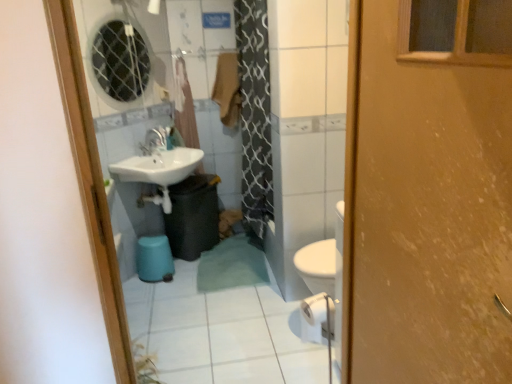
At what (x,y) coordinates should I click in order to perform the action: click on black plastic trash can at lower center. Please return your answer as a coordinate pair (x, y). This screenshot has height=384, width=512. Looking at the image, I should click on (193, 216).

Find the location of `matte white faucet at center`. matte white faucet at center is located at coordinates (156, 141).

This screenshot has height=384, width=512. Find the location of `transparent glass mirror at upper left`. transparent glass mirror at upper left is located at coordinates (119, 62).

At what (x,y) coordinates should I click in order to perform the action: click on brown fabric towel at upper center. Please return your answer as a coordinate pair (x, y). This screenshot has height=384, width=512. Looking at the image, I should click on (227, 89).

From a real-world perspective, is wooden door at right under brown fabric towel at upper center?

Yes, from a real-world perspective, wooden door at right is beneath brown fabric towel at upper center.

In terms of width, does wooden door at right look wider or thinner when compared to brown fabric towel at upper center?

Considering their sizes, wooden door at right looks broader than brown fabric towel at upper center.

Consider the image. Does wooden door at right appear on the right side of brown fabric towel at upper center?

Correct, you'll find wooden door at right to the right of brown fabric towel at upper center.

Are wooden door at right and brown fabric towel at upper center beside each other?

No, wooden door at right is not touching brown fabric towel at upper center.

Identify the location of laundry to the right of black plastic trash can at lower center. The width and height of the screenshot is (512, 384). (227, 89).

Which object is closer to the camera, brown fabric towel at upper center or black plastic trash can at lower center?

Positioned in front is black plastic trash can at lower center.

Is brown fabric towel at upper center at the left side of black plastic trash can at lower center?

Incorrect, brown fabric towel at upper center is not on the left side of black plastic trash can at lower center.

Can you confirm if brown fabric towel at upper center is thinner than black plastic trash can at lower center?

Yes, brown fabric towel at upper center is thinner than black plastic trash can at lower center.

Which of these two, brown fabric towel at upper center or translucent plastic curtain at upper center, stands taller?

With more height is translucent plastic curtain at upper center.

In the scene shown: Considering the positions of objects brown fabric towel at upper center and translucent plastic curtain at upper center in the image provided, who is more to the right, brown fabric towel at upper center or translucent plastic curtain at upper center?

From the viewer's perspective, brown fabric towel at upper center appears more on the right side.

Is translucent plastic curtain at upper center at the back of brown fabric towel at upper center?

brown fabric towel at upper center is not turned away from translucent plastic curtain at upper center.

Could you tell me if wooden door at right is turned towards black plastic trash can at lower center?

No.

Which is behind, wooden door at right or black plastic trash can at lower center?

black plastic trash can at lower center is further away from the camera.

From the image's perspective, is wooden door at right above or below black plastic trash can at lower center?

wooden door at right is below black plastic trash can at lower center.

In terms of width, does wooden door at right look wider or thinner when compared to black plastic trash can at lower center?

wooden door at right is thinner than black plastic trash can at lower center.

From a real-world perspective, is black plastic trash can at lower center located beneath matte white faucet at center?

Yes.

Is matte white faucet at center at the back of black plastic trash can at lower center?

No, black plastic trash can at lower center is not facing the opposite direction of matte white faucet at center.

How distant is black plastic trash can at lower center from matte white faucet at center?

They are 20.84 inches apart.

The image size is (512, 384). Identify the location of tap on the left side of black plastic trash can at lower center. pyautogui.click(x=156, y=141).

Does black plastic trash can at lower center have a smaller size compared to brown fabric towel at upper center?

No.

Would you say black plastic trash can at lower center is a long distance from brown fabric towel at upper center?

They are positioned close to each other.

Could brown fabric towel at upper center be considered to be inside black plastic trash can at lower center?

No, black plastic trash can at lower center does not contain brown fabric towel at upper center.

Is point (185, 243) positioned before point (237, 101)?

Yes, it is.

Is matte blue stool at lower left facing away from translucent plastic curtain at upper center?

That's not correct — matte blue stool at lower left is not looking away from translucent plastic curtain at upper center.

Considering the sizes of objects matte blue stool at lower left and translucent plastic curtain at upper center in the image provided, who is wider, matte blue stool at lower left or translucent plastic curtain at upper center?

With larger width is matte blue stool at lower left.

How many degrees apart are the facing directions of matte blue stool at lower left and translucent plastic curtain at upper center?

The angle between the facing direction of matte blue stool at lower left and the facing direction of translucent plastic curtain at upper center is 55.7 degrees.

From the image's perspective, is matte blue stool at lower left below translucent plastic curtain at upper center?

Indeed, from the image's perspective, matte blue stool at lower left is shown beneath translucent plastic curtain at upper center.

Where is `door in front of the brown fabric towel at upper center`? The width and height of the screenshot is (512, 384). door in front of the brown fabric towel at upper center is located at coordinates (424, 212).

You are a GUI agent. You are given a task and a screenshot of the screen. Output one action in this format:
    pyautogui.click(x=<x>, y=<y>)
    Task: Click on the laundry behind the black plastic trash can at lower center
    The image size is (512, 384).
    Given the screenshot: What is the action you would take?
    pyautogui.click(x=227, y=89)

From the picture: Considering their positions, is translucent plastic curtain at upper center positioned closer to brown fabric towel at upper center than matte white faucet at center?

Among the two, translucent plastic curtain at upper center is located nearer to brown fabric towel at upper center.

Estimate the real-world distances between objects in this image. Which object is closer to matte white faucet at center, wooden door at right or transparent glass mirror at upper left?

transparent glass mirror at upper left lies closer to matte white faucet at center than the other object.

When comparing their distances from matte blue stool at lower left, does black plastic trash can at lower center or brown fabric towel at upper center seem further?

The object further to matte blue stool at lower left is brown fabric towel at upper center.

When comparing their distances from wooden door at right, does translucent plastic curtain at upper center or transparent glass mirror at upper left seem further?

The object further to wooden door at right is transparent glass mirror at upper left.

From the picture: Looking at the image, which one is located closer to matte blue stool at lower left, transparent glass mirror at upper left or black plastic trash can at lower center?

black plastic trash can at lower center.

Based on their spatial positions, is transparent glass mirror at upper left or matte blue stool at lower left further from matte white faucet at center?

Based on the image, transparent glass mirror at upper left appears to be further to matte white faucet at center.

Looking at the image, which one is located further to transparent glass mirror at upper left, wooden door at right or matte white faucet at center?

Based on the image, wooden door at right appears to be further to transparent glass mirror at upper left.

When comparing their distances from brown fabric towel at upper center, does black plastic trash can at lower center or wooden door at right seem closer?

Among the two, black plastic trash can at lower center is located nearer to brown fabric towel at upper center.

Locate an element on the screen. tap between translucent plastic curtain at upper center and matte blue stool at lower left vertically is located at coordinates (156, 141).

What are the coordinates of `tap between transparent glass mirror at upper left and black plastic trash can at lower center from top to bottom` in the screenshot? It's located at (156, 141).

Identify the location of curtain between transparent glass mirror at upper left and black plastic trash can at lower center in the up-down direction. (185, 106).

At what (x,y) coordinates should I click in order to perform the action: click on garbage between transparent glass mirror at upper left and matte blue stool at lower left in the up-down direction. Please return your answer as a coordinate pair (x, y). Looking at the image, I should click on (193, 216).